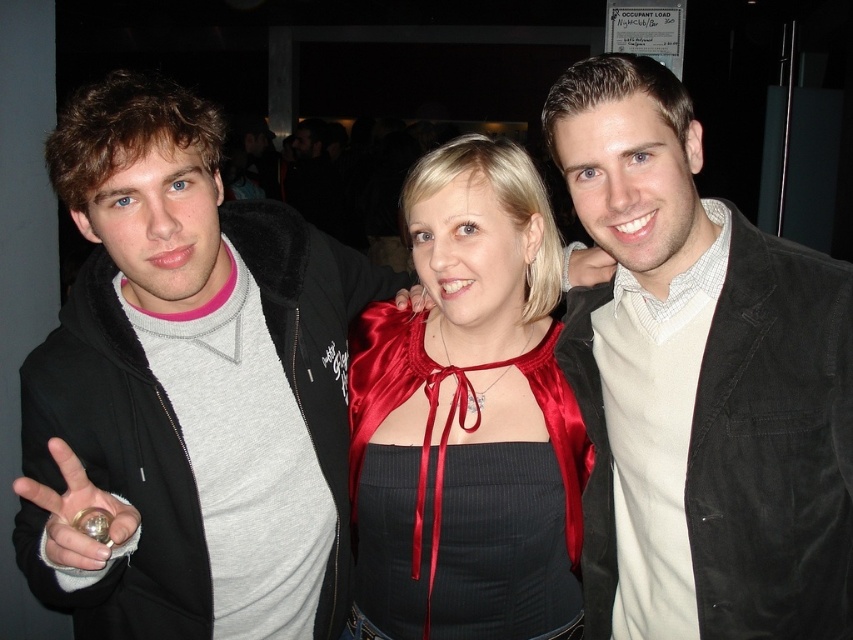
You are a photographer trying to capture a group photo of the matte black jacket at left and the satin cape at center. The camera has a limited focus range. Which object should you focus on first to ensure both are in focus?

The matte black jacket at left might be wider than the satin cape at center, so focusing on the wider object first could help ensure both are in focus.

Based on the photo, you are standing at the point labeled point (39, 380) and want to reach a door located 1.2 meters away from you in a straight line. Can you reach the door without moving past your current position?

The distance between you and the viewer is 1.13 meters, so you are 1.13 meters away from the viewer. Since the door is 1.2 meters away from you, the door is 0.07 meters beyond the viewer. Therefore, you can reach the door without moving past your current position.

You are at a party and want to hand a drink to the person wearing the suede jacket at center without touching the matte black jacket at left. Which direction should you approach from?

You should approach from the right side of the suede jacket at center because the matte black jacket at left is positioned to its left, so approaching from the right avoids contact with the matte black jacket at left.